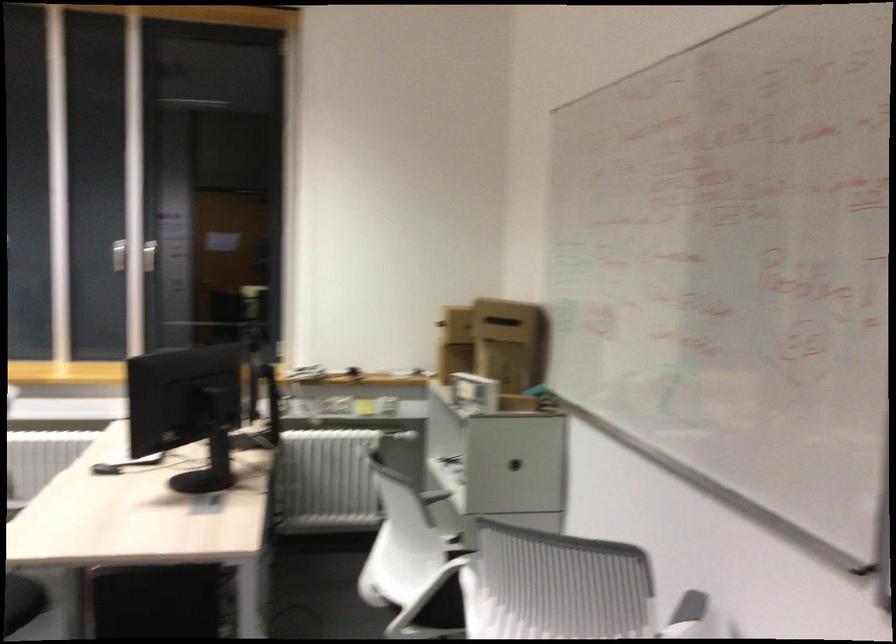
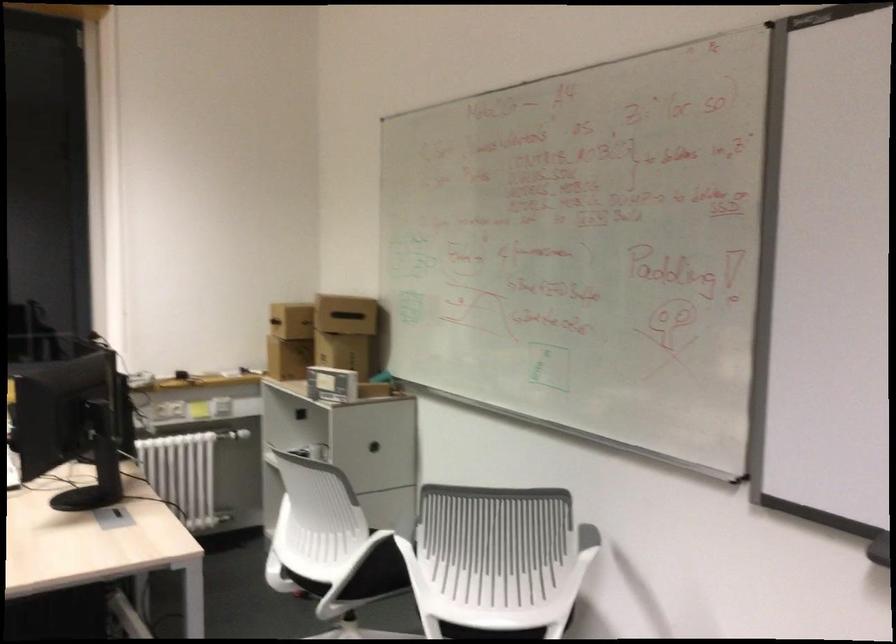
In the scene shown: Which direction would the cameraman need to move to produce the second image?

The movement direction of the cameraman is left, backward.